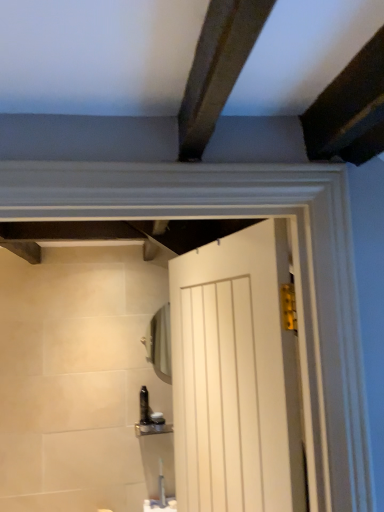
Question: Considering the relative positions of white matte door at center and clear glass mirror at upper center in the image provided, is white matte door at center to the left or to the right of clear glass mirror at upper center?

Choices:
 (A) right
 (B) left

Answer: (A)

Question: From a real-world perspective, relative to clear glass mirror at upper center, is white matte door at center vertically above or below?

Choices:
 (A) below
 (B) above

Answer: (A)

Question: From the image's perspective, is white matte door at center positioned above or below clear glass mirror at upper center?

Choices:
 (A) above
 (B) below

Answer: (A)

Question: Does point pyautogui.click(x=150, y=330) appear closer or farther from the camera than point pyautogui.click(x=226, y=294)?

Choices:
 (A) closer
 (B) farther

Answer: (B)

Question: Considering their positions, is clear glass mirror at upper center located in front of or behind white matte door at center?

Choices:
 (A) front
 (B) behind

Answer: (B)

Question: In terms of height, does clear glass mirror at upper center look taller or shorter compared to white matte door at center?

Choices:
 (A) short
 (B) tall

Answer: (A)

Question: From the image's perspective, is clear glass mirror at upper center positioned above or below white matte door at center?

Choices:
 (A) above
 (B) below

Answer: (B)